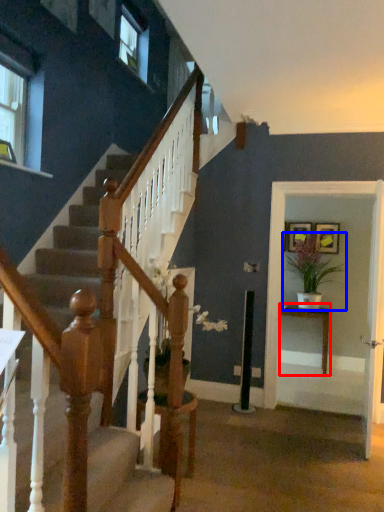
Question: Which object appears closest to the camera in this image, table (highlighted by a red box) or houseplant (highlighted by a blue box)?

Choices:
 (A) table
 (B) houseplant

Answer: (B)